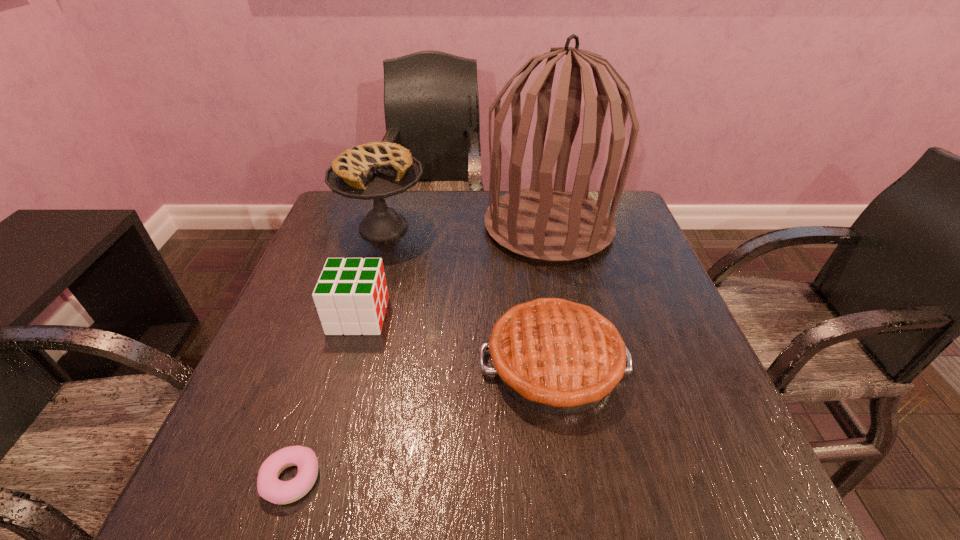
The height and width of the screenshot is (540, 960). Find the location of `pie that is at the right edge`. pie that is at the right edge is located at coordinates (556, 356).

The image size is (960, 540). In order to click on object that is at the far left corner in this screenshot , I will do `click(377, 170)`.

At what (x,y) coordinates should I click in order to perform the action: click on object positioned at the near left corner. Please return your answer as a coordinate pair (x, y). Looking at the image, I should click on (269, 487).

You are a GUI agent. You are given a task and a screenshot of the screen. Output one action in this format:
    pyautogui.click(x=<x>, y=<y>)
    Task: Click on the object present at the far right corner
    The image size is (960, 540).
    Given the screenshot: What is the action you would take?
    pyautogui.click(x=552, y=224)

Image resolution: width=960 pixels, height=540 pixels. Identify the location of vacant space at the far edge of the desktop. point(492,201).

The width and height of the screenshot is (960, 540). Identify the location of free space at the near edge of the desktop. (434, 475).

In the image, there is a desktop. Identify the location of vacant space at the left edge. [329, 376].

You are a GUI agent. You are given a task and a screenshot of the screen. Output one action in this format:
    pyautogui.click(x=<x>, y=<y>)
    Task: Click on the vacant space at the right edge of the desktop
    The image size is (960, 540).
    Given the screenshot: What is the action you would take?
    pyautogui.click(x=675, y=348)

Where is `free spot at the far left corner of the desktop`? free spot at the far left corner of the desktop is located at coordinates (344, 201).

At what (x,y) coordinates should I click in order to perform the action: click on free space at the near right corner. Please return your answer as a coordinate pair (x, y). Looking at the image, I should click on (737, 487).